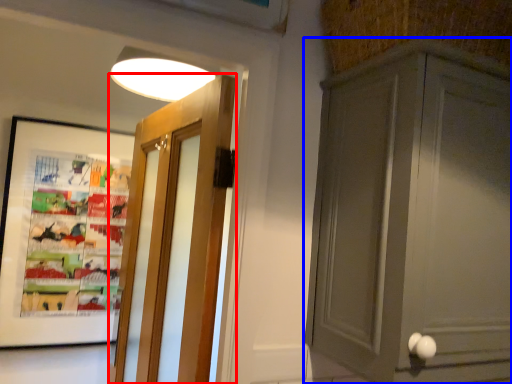
Question: Which of the following is the farthest to the observer, door (highlighted by a red box) or cabinetry (highlighted by a blue box)?

Choices:
 (A) door
 (B) cabinetry

Answer: (A)